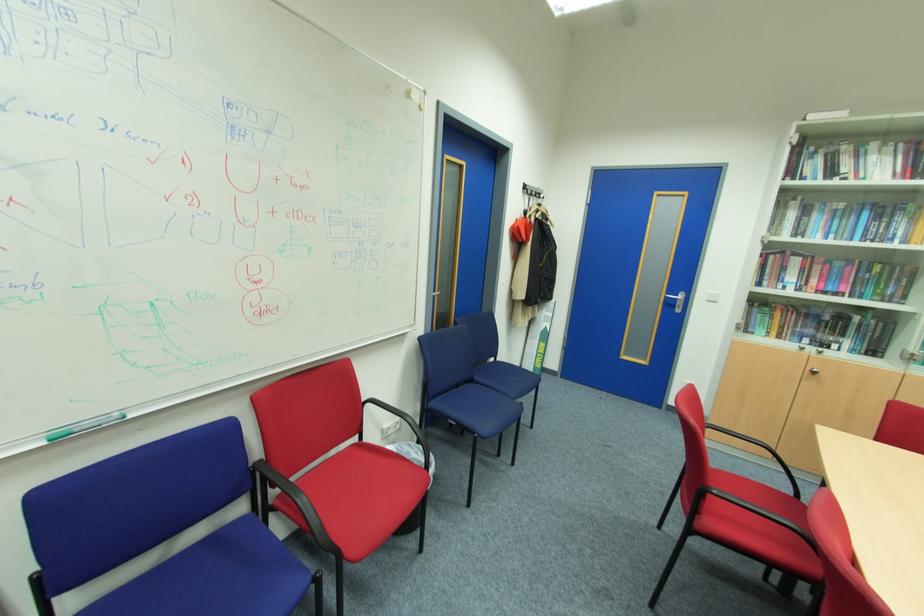
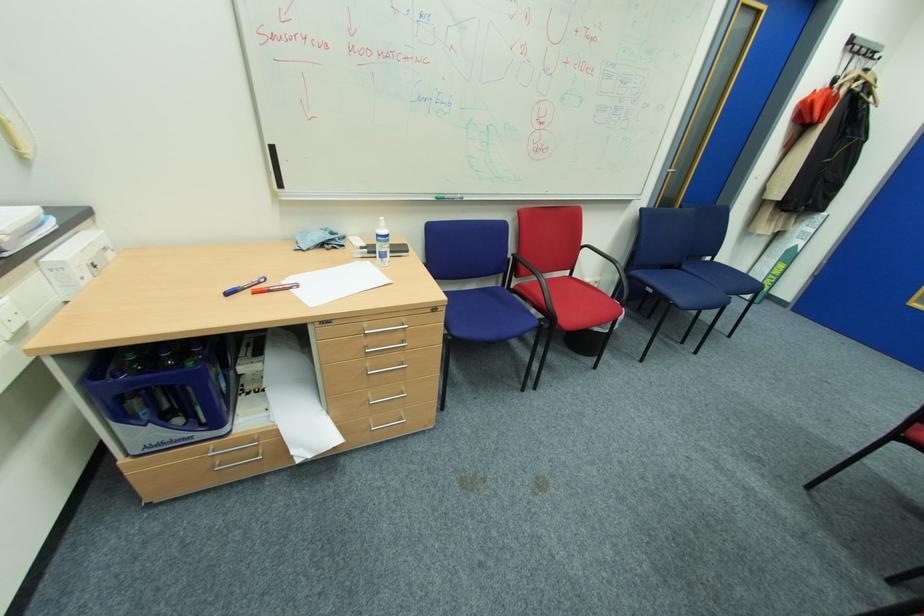
First-person continuous shooting, in which direction is the camera rotating?

The camera's rotation is toward left-down.